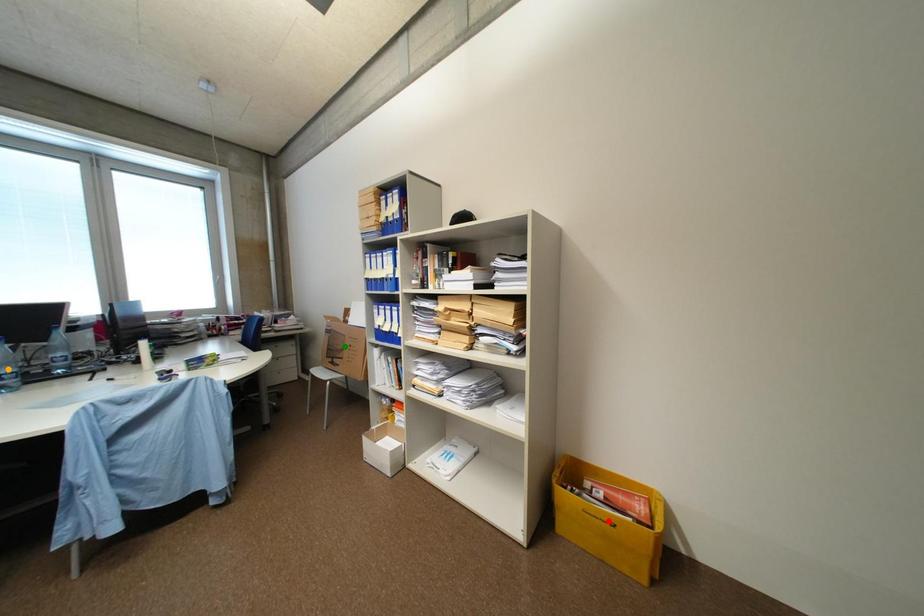
Order these from nearest to farthest:
green point, red point, orange point

1. orange point
2. red point
3. green point